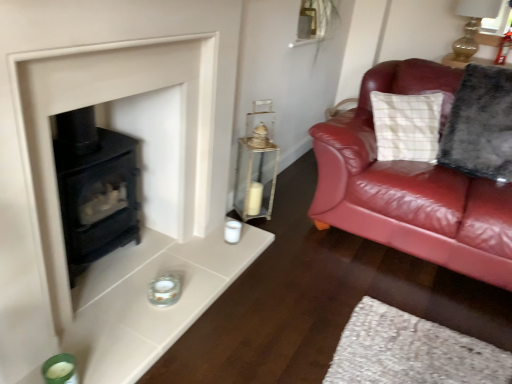
In order to face fluffy gray pillow at right, should I rotate leftwards or rightwards?

Rotate your view right by about 28.747°.

Identify the location of fluffy gray pillow at right. (480, 125).

This screenshot has height=384, width=512. What are the coordinates of `clear glass lantern at center` in the screenshot? It's located at (255, 180).

Image resolution: width=512 pixels, height=384 pixels. What do you see at coordinates (255, 180) in the screenshot?
I see `clear glass lantern at center` at bounding box center [255, 180].

This screenshot has height=384, width=512. What do you see at coordinates (104, 102) in the screenshot?
I see `matte black stove at lower left` at bounding box center [104, 102].

You are a GUI agent. You are given a task and a screenshot of the screen. Output one action in this format:
    pyautogui.click(x=<x>, y=<y>)
    Task: Click on the matte black stove at lower left
    This screenshot has width=512, height=384.
    Given the screenshot: What is the action you would take?
    pyautogui.click(x=104, y=102)

Find the location of a particular element. Image resolution: width=512 pixels, height=384 pixels. fluffy gray pillow at right is located at coordinates (480, 125).

Is gold glass oil lamp at upper right beside fluffy gray pillow at right?

There is a gap between gold glass oil lamp at upper right and fluffy gray pillow at right.

Is gold glass oil lamp at upper right smaller than fluffy gray pillow at right?

Yes, gold glass oil lamp at upper right is smaller than fluffy gray pillow at right.

From the image's perspective, between gold glass oil lamp at upper right and fluffy gray pillow at right, who is located below?

fluffy gray pillow at right.

Image resolution: width=512 pixels, height=384 pixels. Find the location of `oil lamp behind the fluffy gray pillow at right`. oil lamp behind the fluffy gray pillow at right is located at coordinates (472, 27).

Is green glass candle holder at lower left, which is counted as the second candle holder, starting from the back, positioned with its back to gold glass oil lamp at upper right?

green glass candle holder at lower left, which is counted as the second candle holder, starting from the back, is not turned away from gold glass oil lamp at upper right.

Is green glass candle holder at lower left, the 2th candle holder positioned from the top, far from gold glass oil lamp at upper right?

green glass candle holder at lower left, the 2th candle holder positioned from the top, is positioned a significant distance from gold glass oil lamp at upper right.

From the image's perspective, which one is positioned lower, green glass candle holder at lower left, the 2th candle holder positioned from the top, or gold glass oil lamp at upper right?

green glass candle holder at lower left, the 2th candle holder positioned from the top.

From the image's perspective, is matte glass candle holder at lower center, the 2th candle holder when ordered from left to right, beneath gold glass oil lamp at upper right?

Indeed, from the image's perspective, matte glass candle holder at lower center, the 2th candle holder when ordered from left to right, is shown beneath gold glass oil lamp at upper right.

Is matte glass candle holder at lower center, which is the 2th candle holder in bottom-to-top order, looking in the opposite direction of gold glass oil lamp at upper right?

No, matte glass candle holder at lower center, which is the 2th candle holder in bottom-to-top order,'s orientation is not away from gold glass oil lamp at upper right.

From the picture: Could you measure the distance between matte glass candle holder at lower center, which ranks as the 1th candle holder in top-to-bottom order, and gold glass oil lamp at upper right?

matte glass candle holder at lower center, which ranks as the 1th candle holder in top-to-bottom order, and gold glass oil lamp at upper right are 2.98 meters apart from each other.

Is matte glass candle holder at lower center, which is the 2th candle holder in bottom-to-top order, positioned far away from gold glass oil lamp at upper right?

matte glass candle holder at lower center, which is the 2th candle holder in bottom-to-top order, is far away from gold glass oil lamp at upper right.

Between gold glass oil lamp at upper right and clear glass lantern at center, which one has larger size?

Bigger between the two is gold glass oil lamp at upper right.

Considering the positions of objects gold glass oil lamp at upper right and clear glass lantern at center in the image provided, who is more to the right, gold glass oil lamp at upper right or clear glass lantern at center?

Result: gold glass oil lamp at upper right is more to the right.

Can clear glass lantern at center be found inside gold glass oil lamp at upper right?

No, clear glass lantern at center is not surrounded by gold glass oil lamp at upper right.

Is point (489, 13) closer or farther from the camera than point (277, 165)?

Point (489, 13) appears to be farther away from the viewer than point (277, 165).

Is green glass candle holder at lower left, which appears as the 2th candle holder when viewed from the right, at the left side of matte black stove at lower left?

Indeed, green glass candle holder at lower left, which appears as the 2th candle holder when viewed from the right, is positioned on the left side of matte black stove at lower left.

Measure the distance from green glass candle holder at lower left, which appears as the 2th candle holder when viewed from the right, to matte black stove at lower left.

green glass candle holder at lower left, which appears as the 2th candle holder when viewed from the right, and matte black stove at lower left are 31.45 inches apart.

How many degrees apart are the facing directions of green glass candle holder at lower left, the first candle holder from the bottom, and matte black stove at lower left?

There is a 2.74-degree angle between the facing directions of green glass candle holder at lower left, the first candle holder from the bottom, and matte black stove at lower left.

Which object is further away from the camera, green glass candle holder at lower left, the first candle holder from the bottom, or matte black stove at lower left?

green glass candle holder at lower left, the first candle holder from the bottom, is more distant.

Considering the sizes of objects gold glass oil lamp at upper right and matte glass candle holder at lower center, which is the 2th candle holder in bottom-to-top order, in the image provided, who is smaller, gold glass oil lamp at upper right or matte glass candle holder at lower center, which is the 2th candle holder in bottom-to-top order,?

matte glass candle holder at lower center, which is the 2th candle holder in bottom-to-top order, is smaller.

In the scene shown: Is gold glass oil lamp at upper right to the right of matte glass candle holder at lower center, which is the 2th candle holder in bottom-to-top order, from the viewer's perspective?

Indeed, gold glass oil lamp at upper right is positioned on the right side of matte glass candle holder at lower center, which is the 2th candle holder in bottom-to-top order.

Is gold glass oil lamp at upper right facing away from matte glass candle holder at lower center, which ranks as the 1th candle holder in top-to-bottom order?

gold glass oil lamp at upper right is not turned away from matte glass candle holder at lower center, which ranks as the 1th candle holder in top-to-bottom order.

Which is more to the right, clear glass lantern at center or gold glass oil lamp at upper right?

gold glass oil lamp at upper right is more to the right.

Which of these two, clear glass lantern at center or gold glass oil lamp at upper right, is smaller?

With smaller size is clear glass lantern at center.

From the image's perspective, which object appears higher, clear glass lantern at center or gold glass oil lamp at upper right?

From the image's view, gold glass oil lamp at upper right is above.

What's the angular difference between clear glass lantern at center and gold glass oil lamp at upper right's facing directions?

53.1 degrees.

The width and height of the screenshot is (512, 384). What are the coordinates of `pillow below the gold glass oil lamp at upper right (from the image's perspective)` in the screenshot? It's located at (480, 125).

The image size is (512, 384). What are the coordinates of `oil lamp on the right of green glass candle holder at lower left, the first candle holder from the bottom` in the screenshot? It's located at 472,27.

Based on their spatial positions, is matte black stove at lower left or fluffy gray pillow at right closer to gold glass oil lamp at upper right?

fluffy gray pillow at right.

Based on their spatial positions, is matte black stove at lower left or fluffy gray pillow at right further from green glass candle holder at lower left, which ranks as the 1th candle holder in front-to-back order?

fluffy gray pillow at right lies further to green glass candle holder at lower left, which ranks as the 1th candle holder in front-to-back order, than the other object.

When comparing their distances from matte glass candle holder at lower center, arranged as the 1th candle holder when viewed from the back, does matte black stove at lower left or gold glass oil lamp at upper right seem closer?

Based on the image, matte black stove at lower left appears to be nearer to matte glass candle holder at lower center, arranged as the 1th candle holder when viewed from the back.

Which object lies nearer to the anchor point green glass candle holder at lower left, the first candle holder from the bottom, matte black stove at lower left or matte glass candle holder at lower center, the 2th candle holder when ordered from left to right?

matte glass candle holder at lower center, the 2th candle holder when ordered from left to right.

Based on their spatial positions, is matte glass candle holder at lower center, which is the 2th candle holder in bottom-to-top order, or matte black stove at lower left closer to fluffy gray pillow at right?

matte black stove at lower left is closer to fluffy gray pillow at right.

From the image, which object appears to be farther from clear glass lantern at center, fluffy gray pillow at right or matte black stove at lower left?

Among the two, fluffy gray pillow at right is located further to clear glass lantern at center.

Based on their spatial positions, is clear glass lantern at center or matte glass candle holder at lower center, which is the first candle holder in right-to-left order, closer to green glass candle holder at lower left, the first candle holder from the bottom?

matte glass candle holder at lower center, which is the first candle holder in right-to-left order, is closer to green glass candle holder at lower left, the first candle holder from the bottom.

Based on their spatial positions, is matte black stove at lower left or gold glass oil lamp at upper right closer to fluffy gray pillow at right?

The object closer to fluffy gray pillow at right is gold glass oil lamp at upper right.

Identify the location of fireplace between green glass candle holder at lower left, the 2th candle holder positioned from the top, and gold glass oil lamp at upper right. This screenshot has height=384, width=512. (104, 102).

The image size is (512, 384). In order to click on table between green glass candle holder at lower left, the 2th candle holder positioned from the top, and gold glass oil lamp at upper right from left to right in this screenshot , I will do (255, 180).

Image resolution: width=512 pixels, height=384 pixels. In order to click on pillow between matte glass candle holder at lower center, the 2th candle holder when ordered from left to right, and gold glass oil lamp at upper right from left to right in this screenshot , I will do `click(480, 125)`.

Where is `table between matte glass candle holder at lower center, the 2th candle holder when ordered from left to right, and fluffy gray pillow at right from left to right`? Image resolution: width=512 pixels, height=384 pixels. table between matte glass candle holder at lower center, the 2th candle holder when ordered from left to right, and fluffy gray pillow at right from left to right is located at coordinates (255, 180).